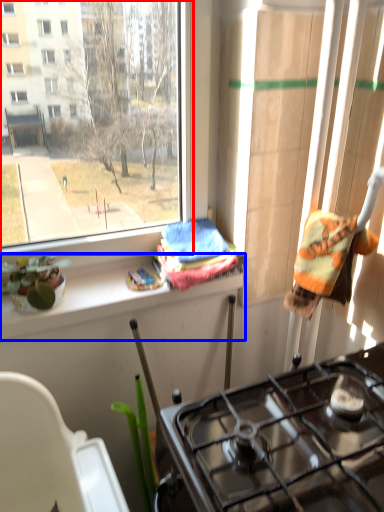
Question: Which point is further to the camera, window (highlighted by a red box) or ledge (highlighted by a blue box)?

Choices:
 (A) window
 (B) ledge

Answer: (B)